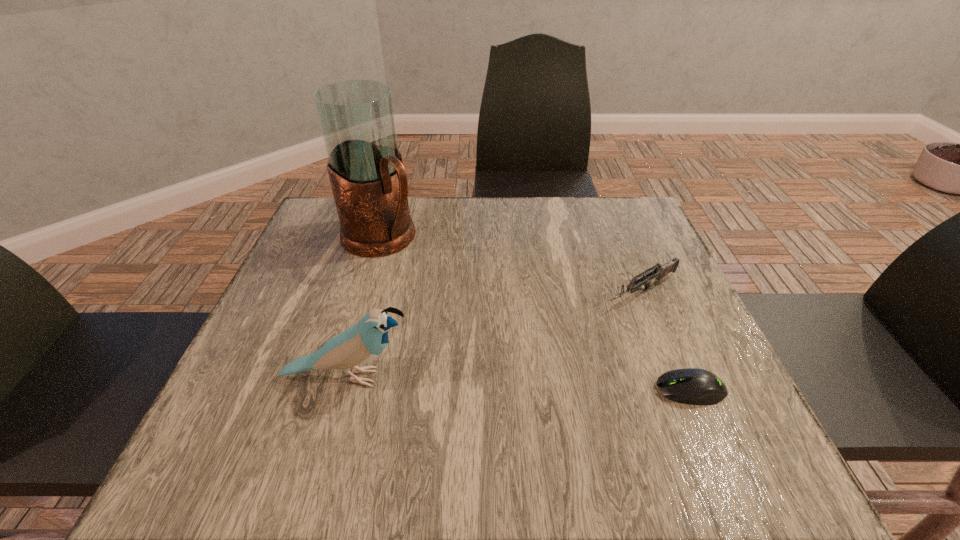
The width and height of the screenshot is (960, 540). I want to click on vacant spot on the desktop that is between the second tallest object and the computer mouse and is positioned with the handle on the side of the tallest object, so click(x=555, y=385).

Identify the location of vacant spot on the desktop that is between the second tallest object and the shortest object and is positioned aimed along the barrel of the third nearest object. The width and height of the screenshot is (960, 540). (492, 382).